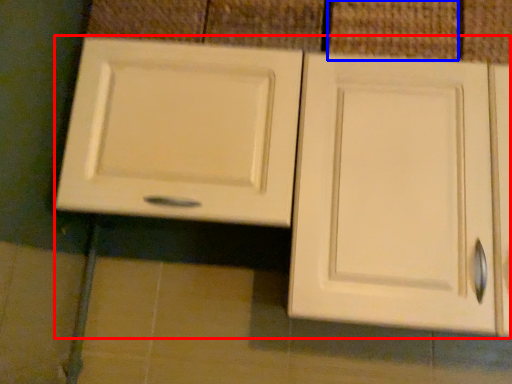
Question: Which object is further to the camera taking this photo, cabinetry (highlighted by a red box) or tile (highlighted by a blue box)?

Choices:
 (A) cabinetry
 (B) tile

Answer: (B)